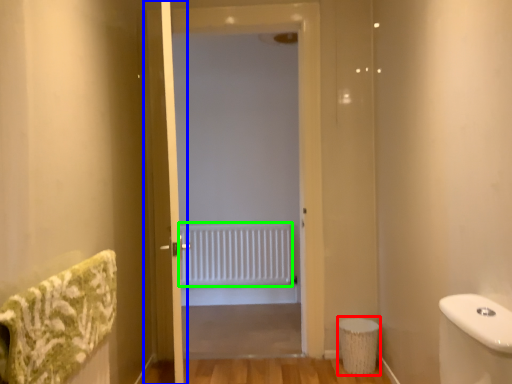
Question: Which object is positioned farthest from toilet bowl (highlighted by a red box)? Select from screen door (highlighted by a blue box) and radiator (highlighted by a green box).

Choices:
 (A) screen door
 (B) radiator

Answer: (B)